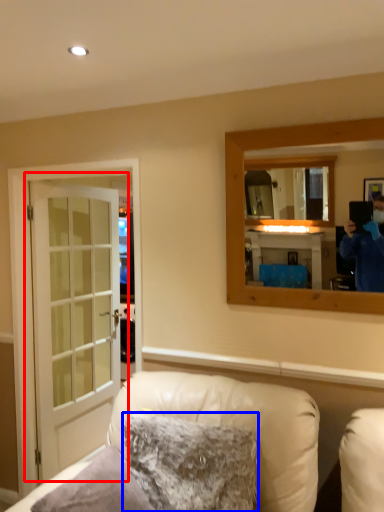
Question: Which object is further to the camera taking this photo, door (highlighted by a red box) or pillow (highlighted by a blue box)?

Choices:
 (A) door
 (B) pillow

Answer: (A)